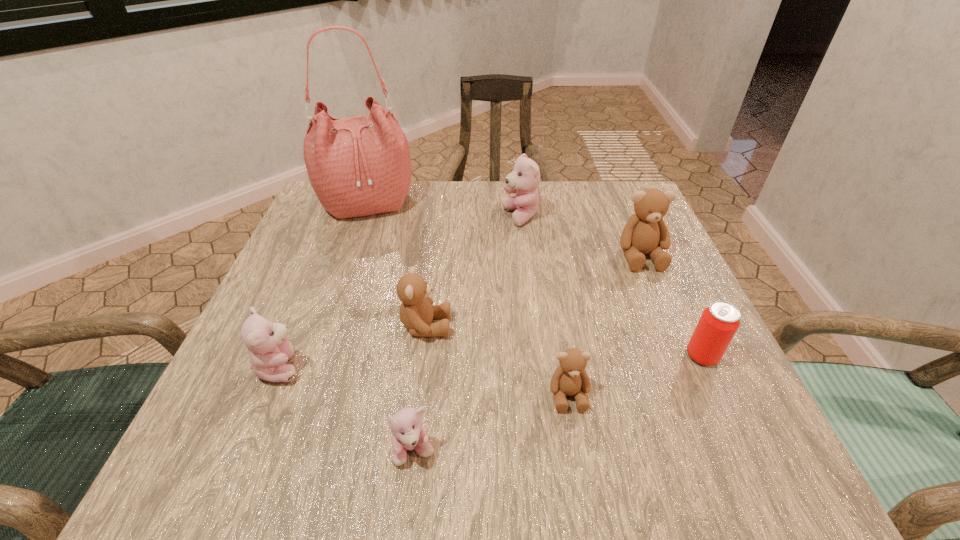
Locate an element on the screen. The width and height of the screenshot is (960, 540). the second brown teddy bear from right to left is located at coordinates (570, 378).

Locate an element on the screen. The height and width of the screenshot is (540, 960). the smallest brown teddy bear is located at coordinates (570, 378).

This screenshot has width=960, height=540. I want to click on the nearest pink teddy bear, so click(408, 433).

Find the location of a particular element. the nearest object is located at coordinates (408, 433).

At what (x,y) coordinates should I click in order to perform the action: click on free spot located 0.330m on the right of the tallest object. Please return your answer as a coordinate pair (x, y). This screenshot has width=960, height=540. Looking at the image, I should click on (545, 204).

Locate an element on the screen. vacant space located at the face of the biggest pink teddy bear is located at coordinates (335, 217).

Where is `vacant space positioned at the face of the biggest pink teddy bear`? The height and width of the screenshot is (540, 960). vacant space positioned at the face of the biggest pink teddy bear is located at coordinates (444, 217).

Identify the location of vacant position located at the face of the biggest pink teddy bear. (410, 217).

The height and width of the screenshot is (540, 960). Find the location of `free space located 0.090m on the face of the biggest brown teddy bear`. free space located 0.090m on the face of the biggest brown teddy bear is located at coordinates (661, 305).

You are a GUI agent. You are given a task and a screenshot of the screen. Output one action in this format:
    pyautogui.click(x=<x>, y=<y>)
    Task: Click on the blank space located 0.130m on the face of the third farthest teddy bear
    Image resolution: width=960 pixels, height=540 pixels.
    Given the screenshot: What is the action you would take?
    pyautogui.click(x=522, y=326)